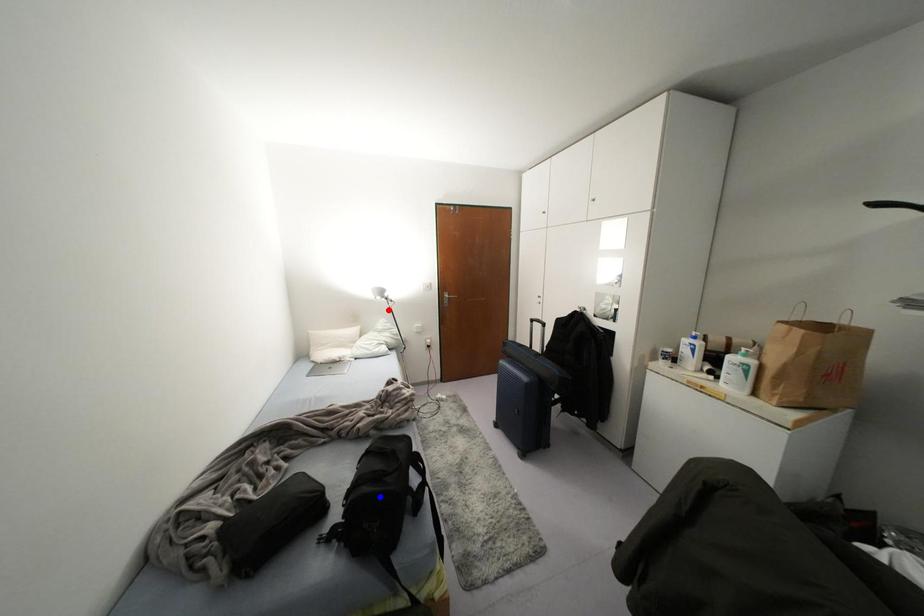
Question: Which of the two points in the image is closer to the camera?

Choices:
 (A) Blue point is closer.
 (B) Red point is closer.

Answer: (A)